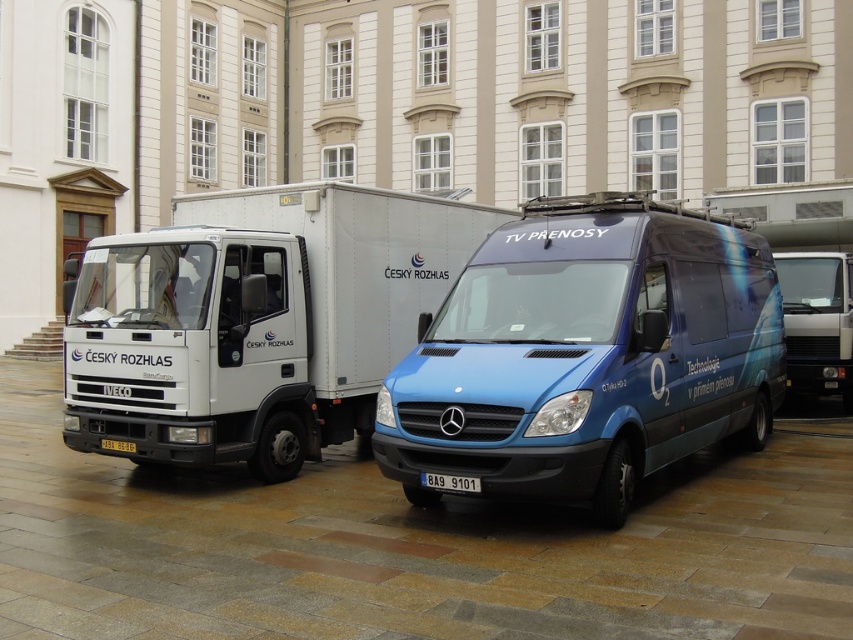
Question: Which point appears closest to the camera in this image?

Choices:
 (A) (672, 308)
 (B) (828, 387)
 (C) (99, 243)

Answer: (A)

Question: Can you confirm if blue metallic van at center is smaller than metallic silver van at center?

Choices:
 (A) no
 (B) yes

Answer: (B)

Question: Which object is positioned farthest from the white matte truck at center?

Choices:
 (A) blue metallic van at center
 (B) metallic silver van at center
 (C) white plastic license plate at center

Answer: (B)

Question: Is blue metallic van at center closer to the viewer compared to white matte truck at center?

Choices:
 (A) yes
 (B) no

Answer: (A)

Question: Can you confirm if white matte truck at center is positioned above black plastic license plate at lower center?

Choices:
 (A) yes
 (B) no

Answer: (A)

Question: Which point is farther to the camera?

Choices:
 (A) (341, 410)
 (B) (469, 492)
 (C) (849, 344)
 (D) (122, 445)

Answer: (C)